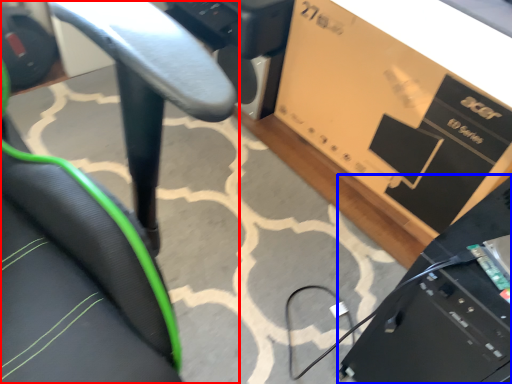
Question: Which object is further to the camera taking this photo, chair (highlighted by a red box) or computer (highlighted by a blue box)?

Choices:
 (A) chair
 (B) computer

Answer: (A)